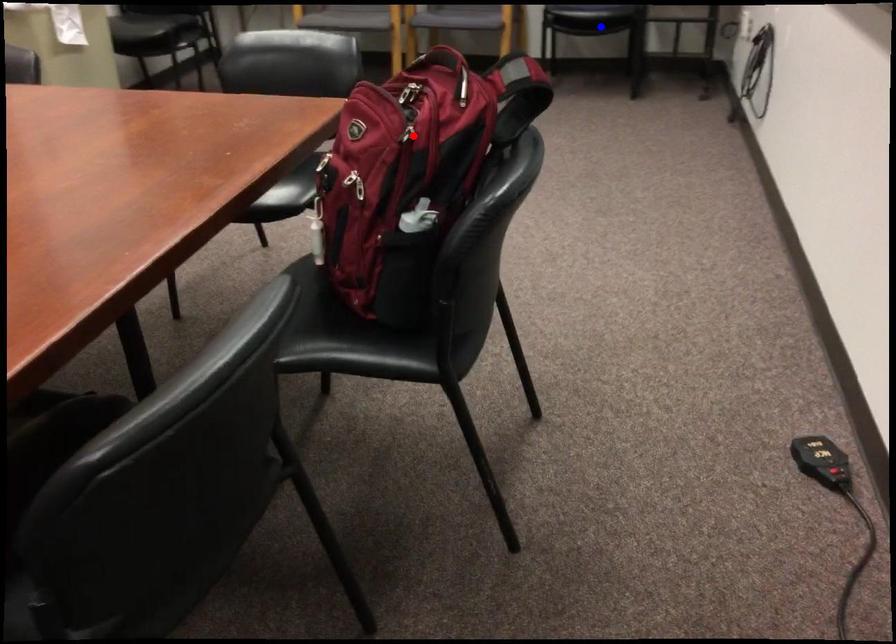
Question: Two points are marked on the image. Which point is closer to the camera?

Choices:
 (A) Blue point is closer.
 (B) Red point is closer.

Answer: (B)